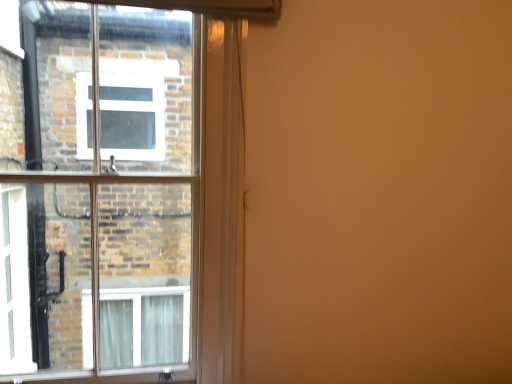
Find the location of a particular element. The image size is (512, 384). clear glass window at left is located at coordinates (109, 199).

What do you see at coordinates (109, 199) in the screenshot?
I see `clear glass window at left` at bounding box center [109, 199].

Locate an element on the screen. clear glass window at left is located at coordinates (109, 199).